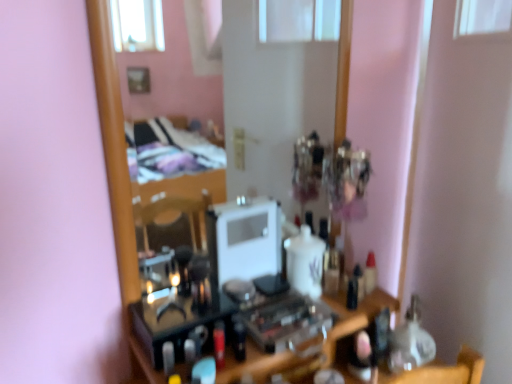
Find the location of a particular element. This screenshot has height=384, width=512. wooden mirror at center is located at coordinates (114, 147).

Describe the element at coordinates (114, 147) in the screenshot. I see `wooden mirror at center` at that location.

Describe the element at coordinates (370, 273) in the screenshot. I see `translucent plastic bottle at center` at that location.

The height and width of the screenshot is (384, 512). I want to click on translucent plastic bottle at center, so click(370, 273).

What is the approximate width of translucent plastic bottle at center?

translucent plastic bottle at center is 1.25 inches in width.

Measure the distance between point (371, 267) and camera.

Point (371, 267) is 1.33 meters away from camera.

In order to face translucent plastic bottle at center, should I rotate leftwards or rightwards?

Turn right approximately 15.422 degrees to face it.

You are a GUI agent. You are given a task and a screenshot of the screen. Output one action in this format:
    pyautogui.click(x=<x>, y=<y>)
    Task: Click on the wooden mirror at center
    The height and width of the screenshot is (384, 512).
    Given the screenshot: What is the action you would take?
    pyautogui.click(x=114, y=147)

Can you confirm if wooden mirror at center is positioned to the left of translucent plastic bottle at center?

Indeed, wooden mirror at center is positioned on the left side of translucent plastic bottle at center.

Between wooden mirror at center and translucent plastic bottle at center, which one is positioned in front?

wooden mirror at center.

Considering the positions of point (132, 237) and point (375, 286), is point (132, 237) closer or farther from the camera than point (375, 286)?

Point (132, 237) appears to be closer to the viewer than point (375, 286).

From the image's perspective, is wooden mirror at center located above or below translucent plastic bottle at center?

Based on their image positions, wooden mirror at center is located above translucent plastic bottle at center.

From a real-world perspective, which is physically above, wooden mirror at center or translucent plastic bottle at center?

In real-world perspective, wooden mirror at center is above.

Does wooden mirror at center have a greater width compared to translucent plastic bottle at center?

Correct, the width of wooden mirror at center exceeds that of translucent plastic bottle at center.

Considering the relative sizes of wooden mirror at center and translucent plastic bottle at center in the image provided, is wooden mirror at center taller than translucent plastic bottle at center?

Yes, wooden mirror at center is taller than translucent plastic bottle at center.

Is wooden mirror at center smaller than translucent plastic bottle at center?

Incorrect, wooden mirror at center is not smaller in size than translucent plastic bottle at center.

Is wooden mirror at center inside or outside of translucent plastic bottle at center?

wooden mirror at center is not inside translucent plastic bottle at center, it's outside.

Are wooden mirror at center and translucent plastic bottle at center located far from each other?

No, there isn't a large distance between wooden mirror at center and translucent plastic bottle at center.

Could you tell me if wooden mirror at center is turned towards translucent plastic bottle at center?

Yes, wooden mirror at center is aimed at translucent plastic bottle at center.

What's the angular difference between wooden mirror at center and translucent plastic bottle at center's facing directions?

The facing directions of wooden mirror at center and translucent plastic bottle at center are 0.589 degrees apart.

Locate an element on the screen. toiletry that is below the wooden mirror at center (from the image's perspective) is located at coordinates (370, 273).

Can you confirm if translucent plastic bottle at center is positioned to the left of wooden mirror at center?

In fact, translucent plastic bottle at center is to the right of wooden mirror at center.

Which object is further away from the camera, translucent plastic bottle at center or wooden mirror at center?

translucent plastic bottle at center is behind.

Which is further, (367, 286) or (121, 194)?

The point (367, 286) is farther.

From the image's perspective, which object appears higher, translucent plastic bottle at center or wooden mirror at center?

wooden mirror at center appears higher in the image.

From a real-world perspective, is translucent plastic bottle at center over wooden mirror at center?

No, from a real-world perspective, translucent plastic bottle at center is not above wooden mirror at center.

Which of these two, translucent plastic bottle at center or wooden mirror at center, is thinner?

translucent plastic bottle at center is thinner.

In terms of height, does translucent plastic bottle at center look taller or shorter compared to wooden mirror at center?

translucent plastic bottle at center is shorter than wooden mirror at center.

Is translucent plastic bottle at center smaller than wooden mirror at center?

Correct, translucent plastic bottle at center occupies less space than wooden mirror at center.

Is translucent plastic bottle at center not inside wooden mirror at center?

Absolutely, translucent plastic bottle at center is external to wooden mirror at center.

Are translucent plastic bottle at center and wooden mirror at center making contact?

translucent plastic bottle at center and wooden mirror at center are not in contact.

Is translucent plastic bottle at center looking in the opposite direction of wooden mirror at center?

That's right, translucent plastic bottle at center is facing away from wooden mirror at center.

How different are the orientations of translucent plastic bottle at center and wooden mirror at center in degrees?

0.589 degrees.

You are a GUI agent. You are given a task and a screenshot of the screen. Output one action in this format:
    pyautogui.click(x=<x>, y=<y>)
    Task: Click on the mirror above the translucent plastic bottle at center (from the image's perspective)
    
    Given the screenshot: What is the action you would take?
    pyautogui.click(x=114, y=147)

Image resolution: width=512 pixels, height=384 pixels. In order to click on toiletry below the wooden mirror at center (from the image's perspective) in this screenshot , I will do `click(370, 273)`.

This screenshot has width=512, height=384. What are the coordinates of `toiletry below the wooden mirror at center (from a real-world perspective)` in the screenshot? It's located at (370, 273).